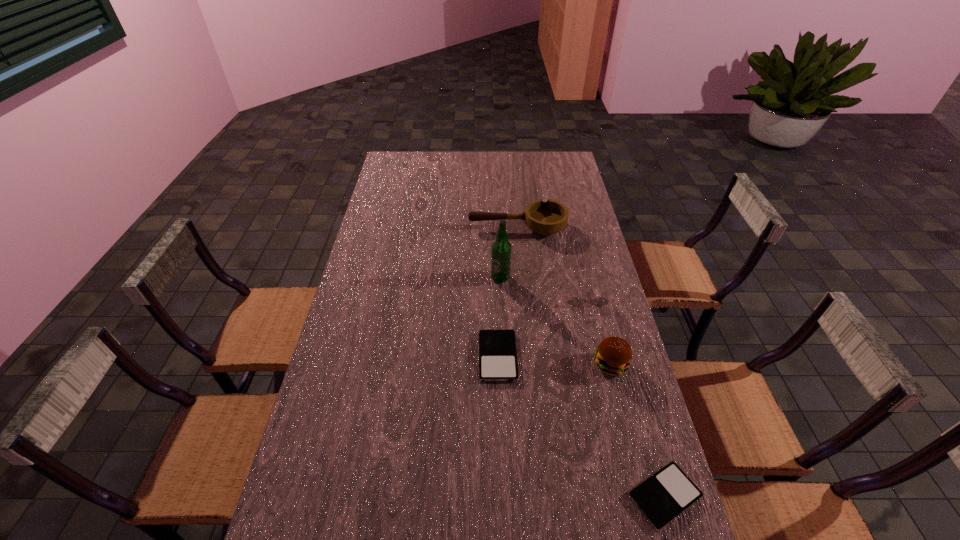
Identify the location of the left iPod. Image resolution: width=960 pixels, height=540 pixels. (497, 348).

You are a GUI agent. You are given a task and a screenshot of the screen. Output one action in this format:
    pyautogui.click(x=<x>, y=<y>)
    Task: Click on the farther iPod
    
    Given the screenshot: What is the action you would take?
    pyautogui.click(x=497, y=348)

Where is `the nearer iPod`? The height and width of the screenshot is (540, 960). the nearer iPod is located at coordinates (662, 497).

At what (x,y) coordinates should I click in order to perform the action: click on the right iPod. Please return your answer as a coordinate pair (x, y). The image size is (960, 540). Looking at the image, I should click on (662, 497).

Where is `the third shortest object`? This screenshot has width=960, height=540. the third shortest object is located at coordinates (577, 301).

Locate an element on the screen. The image size is (960, 540). sunglasses is located at coordinates (577, 301).

Where is `beer bottle`? This screenshot has height=540, width=960. beer bottle is located at coordinates (501, 248).

Where is `the second farthest object`? the second farthest object is located at coordinates (501, 248).

Find the location of a particular element. The width and height of the screenshot is (960, 540). saucepan is located at coordinates (548, 218).

This screenshot has width=960, height=540. Find the location of `the fourth shortest object`. the fourth shortest object is located at coordinates (548, 218).